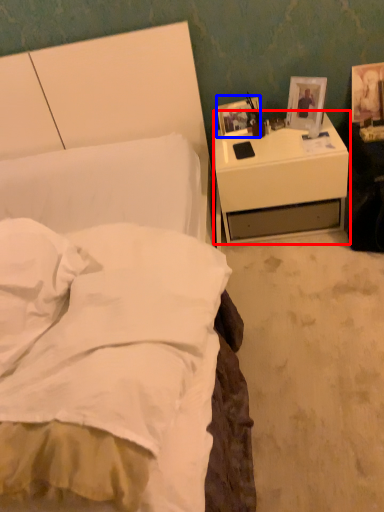
Question: Which point is further to the camera, nightstand (highlighted by a red box) or picture frame (highlighted by a blue box)?

Choices:
 (A) nightstand
 (B) picture frame

Answer: (B)